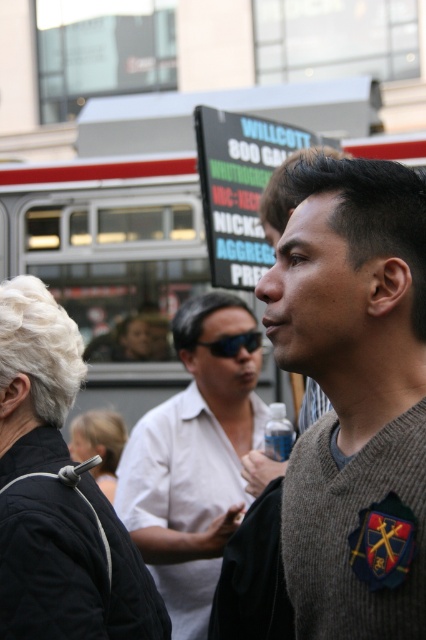
Question: Which object is the closest to the white shirt at center?

Choices:
 (A) black plastic sunglasses at center
 (B) blonde hair at center
 (C) gray wool sweater at center
 (D) black fabric at upper left

Answer: (A)

Question: Which of the following is the farthest from the observer?

Choices:
 (A) (252, 424)
 (B) (104, 465)

Answer: (B)

Question: Does white shirt at center have a smaller size compared to blonde hair at center?

Choices:
 (A) no
 (B) yes

Answer: (A)

Question: Among these objects, which one is nearest to the camera?

Choices:
 (A) blonde hair at center
 (B) black fabric at upper left

Answer: (B)

Question: In this image, where is blonde hair at center located relative to black plastic sunglasses at center?

Choices:
 (A) left
 (B) right

Answer: (A)

Question: Considering the relative positions of black fabric at upper left and white shirt at center in the image provided, where is black fabric at upper left located with respect to white shirt at center?

Choices:
 (A) right
 (B) left

Answer: (B)